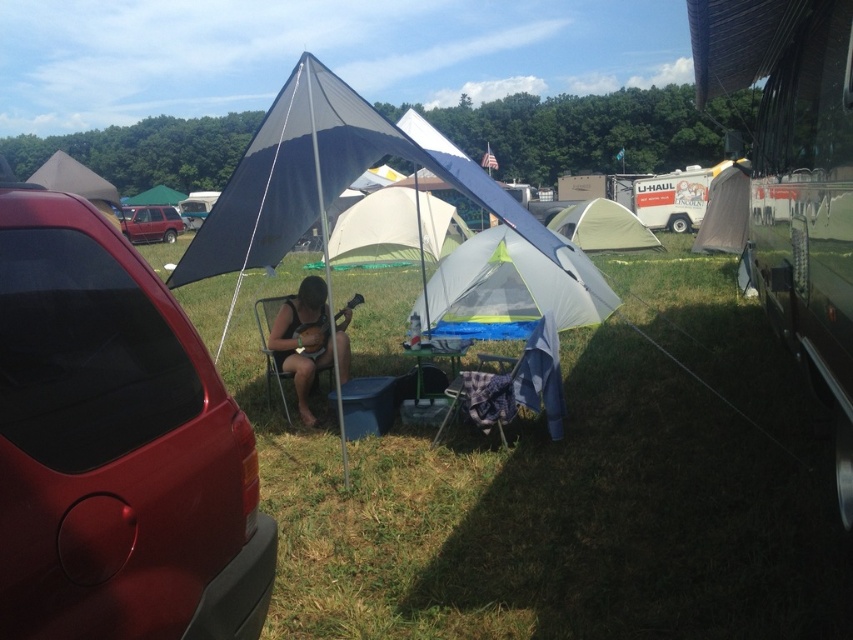
Between white mesh tent at center and matte black guitar at center, which one has less height?

With less height is matte black guitar at center.

Does point (432, 156) come behind point (297, 400)?

That is False.

Is point (322, 129) positioned after point (343, 364)?

No.

This screenshot has height=640, width=853. In order to click on white mesh tent at center in this screenshot , I will do `click(325, 179)`.

Is gray fabric tent at center taller than green plastic picnic table at center?

Yes, gray fabric tent at center is taller than green plastic picnic table at center.

Identify the location of gray fabric tent at center. The image size is (853, 640). (509, 289).

Is point (593, 269) farther from viewer compared to point (410, 346)?

Yes, point (593, 269) is behind point (410, 346).

Image resolution: width=853 pixels, height=640 pixels. I want to click on gray fabric tent at center, so click(x=509, y=289).

Between matte black guitar at center and matte red suv at left, which one has less height?

Standing shorter between the two is matte red suv at left.

Is matte black guitar at center above matte red suv at left?

No, matte black guitar at center is not above matte red suv at left.

Between point (302, 305) and point (144, 218), which one is positioned in front?

Point (302, 305)

Where is `matte black guitar at center`? This screenshot has height=640, width=853. matte black guitar at center is located at coordinates (309, 339).